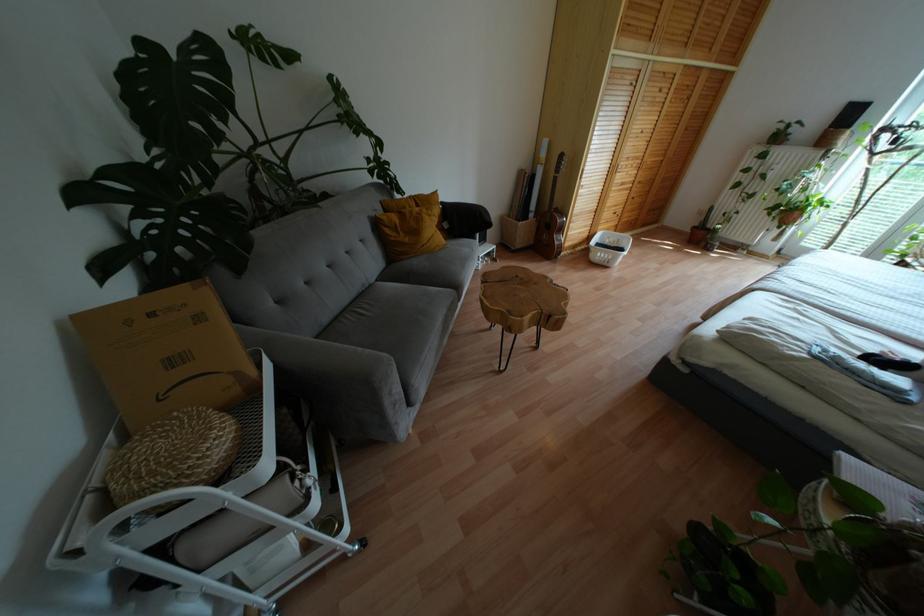
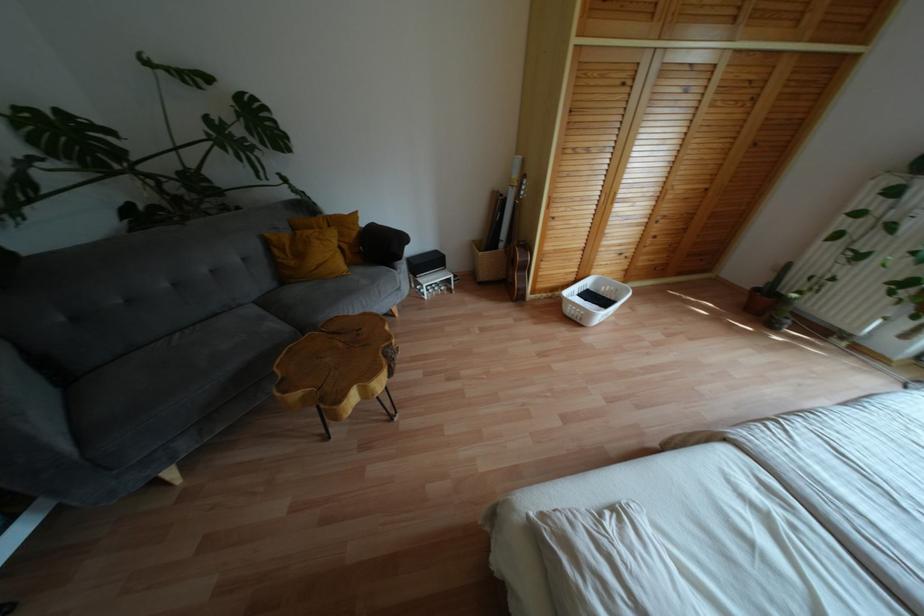
In the second image, find the point that corresponds to (560,229) in the first image.

(525, 267)